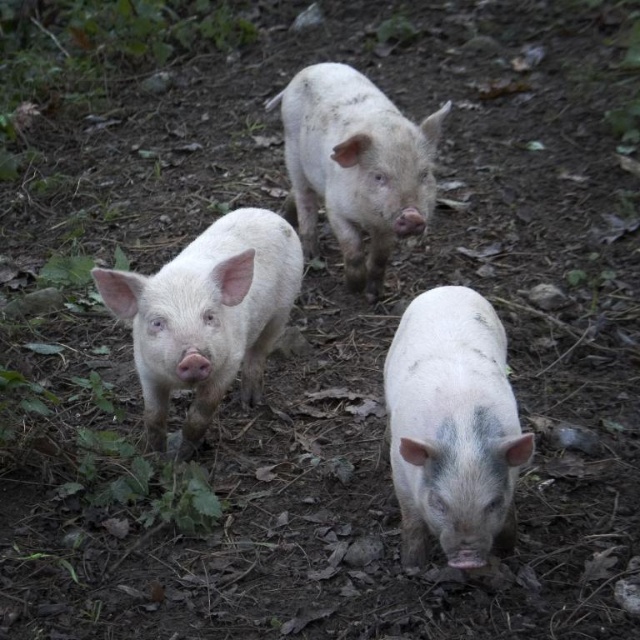
Question: Can you confirm if speckled pink piglet at center is positioned above smooth pink piglet at center?

Choices:
 (A) no
 (B) yes

Answer: (A)

Question: Is smooth pink piglet at center wider than white matte pig at center?

Choices:
 (A) yes
 (B) no

Answer: (B)

Question: Among these points, which one is farthest from the camera?

Choices:
 (A) (376, 152)
 (B) (168, 323)
 (C) (483, 552)

Answer: (A)

Question: Based on their relative distances, which object is farther from the white matte pig at center?

Choices:
 (A) smooth pink piglet at center
 (B) speckled pink piglet at center

Answer: (B)

Question: Is the position of speckled pink piglet at center less distant than that of white matte pig at center?

Choices:
 (A) no
 (B) yes

Answer: (B)

Question: Among these objects, which one is farthest from the camera?

Choices:
 (A) speckled pink piglet at center
 (B) white matte pig at center

Answer: (B)